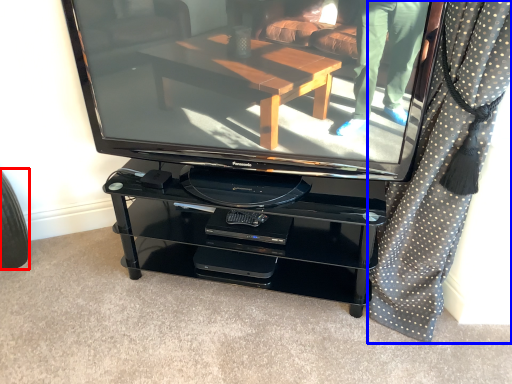
Question: Which object is further to the camera taking this photo, tire (highlighted by a red box) or curtain (highlighted by a blue box)?

Choices:
 (A) tire
 (B) curtain

Answer: (A)